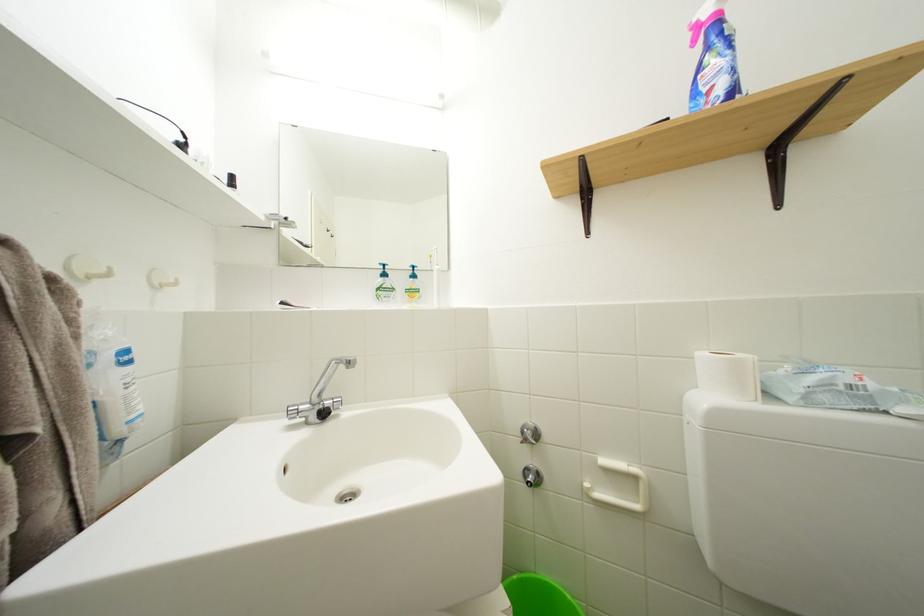
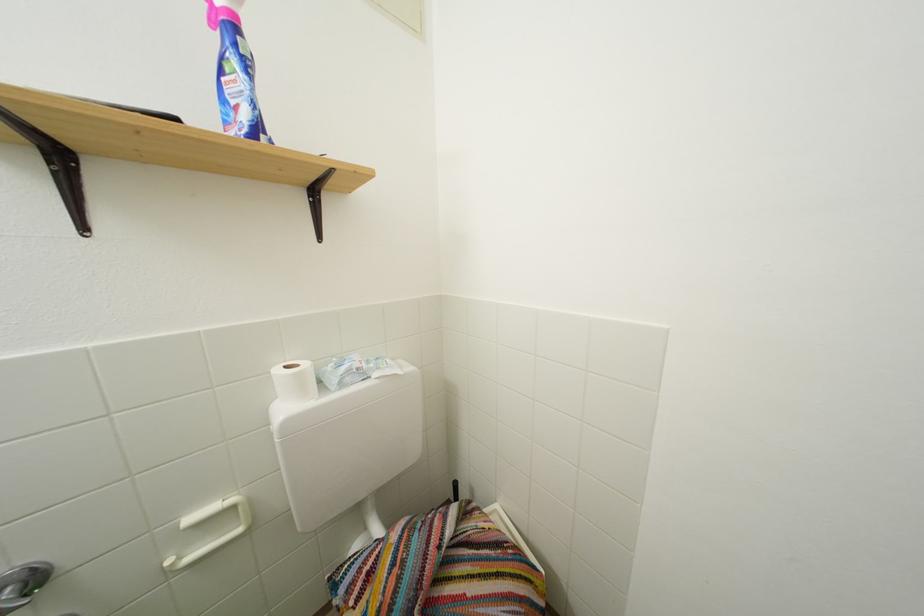
Question: The camera is either moving clockwise (left) or counter-clockwise (right) around the object. The first image is from the beginning of the video and the second image is from the end. Is the camera moving left or right when shooting the video?

Choices:
 (A) Left
 (B) Right

Answer: (A)